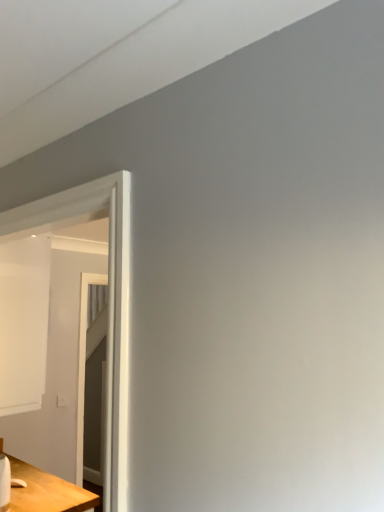
Question: Based on their positions, is wooden table at lower left located to the left or right of white glossy door at left?

Choices:
 (A) right
 (B) left

Answer: (B)

Question: Considering the positions of wooden table at lower left and white glossy door at left in the image, is wooden table at lower left bigger or smaller than white glossy door at left?

Choices:
 (A) small
 (B) big

Answer: (B)

Question: Considering the positions of point (41, 470) and point (119, 332), is point (41, 470) closer or farther from the camera than point (119, 332)?

Choices:
 (A) farther
 (B) closer

Answer: (A)

Question: From a real-world perspective, is white glossy door at left positioned above or below wooden table at lower left?

Choices:
 (A) above
 (B) below

Answer: (A)

Question: In terms of size, does white glossy door at left appear bigger or smaller than wooden table at lower left?

Choices:
 (A) big
 (B) small

Answer: (B)

Question: Based on their positions, is white glossy door at left located to the left or right of wooden table at lower left?

Choices:
 (A) left
 (B) right

Answer: (B)

Question: Would you say white glossy door at left is inside or outside wooden table at lower left?

Choices:
 (A) inside
 (B) outside

Answer: (B)